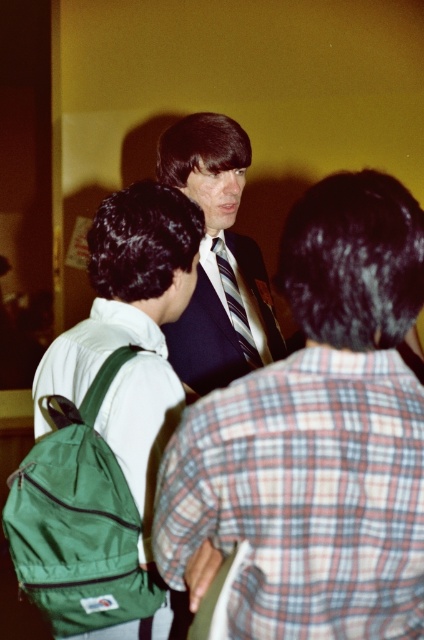
Between point (192, 353) and point (223, 268), which one is positioned behind?

The point (223, 268) is more distant.

Identify the location of dark blue fabric business suit at center. (204, 340).

At what (x,y) coordinates should I click in order to perform the action: click on dark blue fabric business suit at center. Please return your answer as a coordinate pair (x, y). Image resolution: width=424 pixels, height=640 pixels. Looking at the image, I should click on (204, 340).

Does point (298, 321) lie in front of point (145, 193)?

Yes, point (298, 321) is in front of point (145, 193).

Does dark blue suit at center have a greater height compared to green fabric backpack at center?

No, dark blue suit at center is not taller than green fabric backpack at center.

This screenshot has width=424, height=640. Find the location of `dark blue suit at center`. dark blue suit at center is located at coordinates (318, 436).

Is point (61, 508) in front of point (186, 330)?

Yes, it is in front of point (186, 330).

Who is more distant from viewer, [55,628] or [242,356]?

Positioned behind is point [242,356].

Who is more distant from viewer, (33, 522) or (229, 332)?

The point (229, 332) is behind.

This screenshot has width=424, height=640. Find the location of `green fabric backpack at left`. green fabric backpack at left is located at coordinates (78, 520).